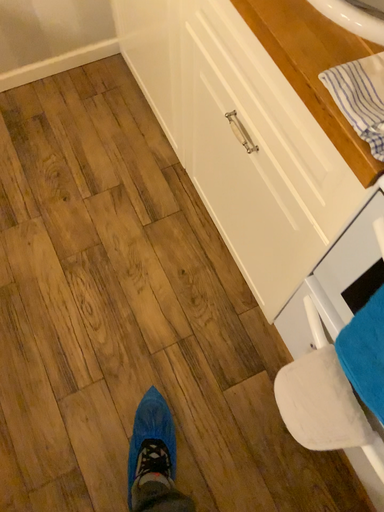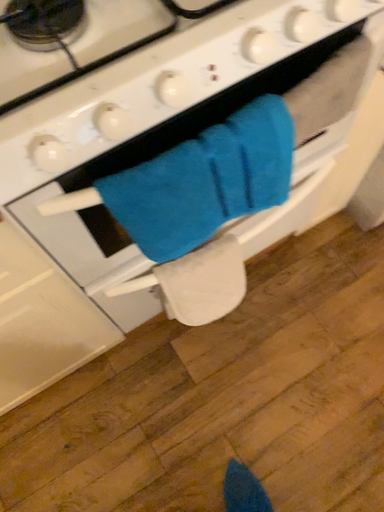
Question: How did the camera likely rotate when shooting the video?

Choices:
 (A) rotated upward
 (B) rotated downward

Answer: (A)